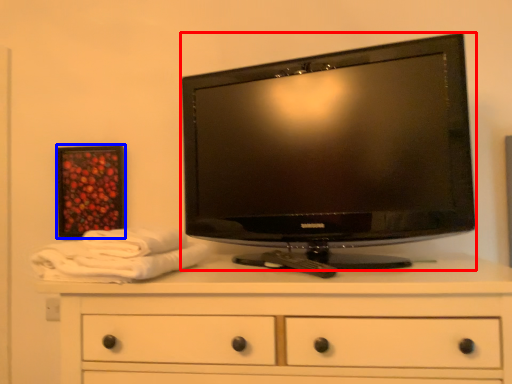
Question: Among these objects, which one is farthest to the camera, television (highlighted by a red box) or picture frame (highlighted by a blue box)?

Choices:
 (A) television
 (B) picture frame

Answer: (B)